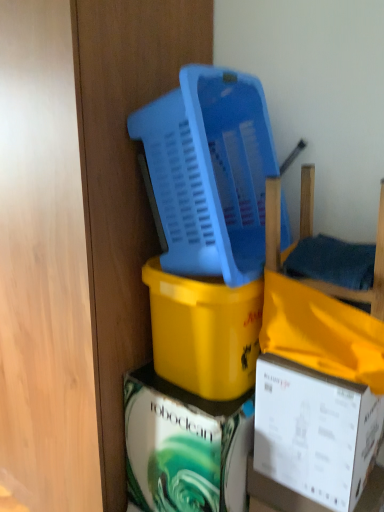
Question: From the image's perspective, is matte white box at center, the 1th box when ordered from bottom to top, above or below wooden chair at right?

Choices:
 (A) above
 (B) below

Answer: (B)

Question: Considering the positions of matte white box at center, the 1th box when ordered from bottom to top, and wooden chair at right in the image, is matte white box at center, the 1th box when ordered from bottom to top, bigger or smaller than wooden chair at right?

Choices:
 (A) big
 (B) small

Answer: (A)

Question: Based on their relative distances, which object is nearer to the matte white box at center, the 1th box when ordered from bottom to top?

Choices:
 (A) blue plastic basket at upper center
 (B) wooden chair at right
 (C) white cardboard box at lower right, which is the second box from top to bottom
 (D) yellow matte plastic bucket at center, which is counted as the 3th box, starting from the bottom

Answer: (D)

Question: Which is farther from the white cardboard box at lower right, which is the second box from top to bottom?

Choices:
 (A) matte white box at center, the 1th box when ordered from bottom to top
 (B) yellow matte plastic bucket at center, which is counted as the 3th box, starting from the bottom
 (C) wooden chair at right
 (D) blue plastic basket at upper center

Answer: (D)